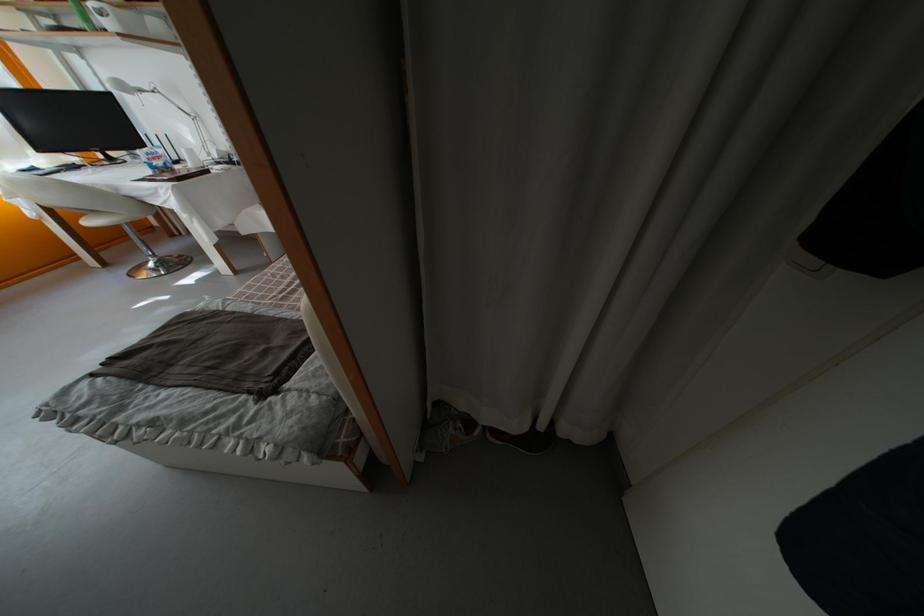
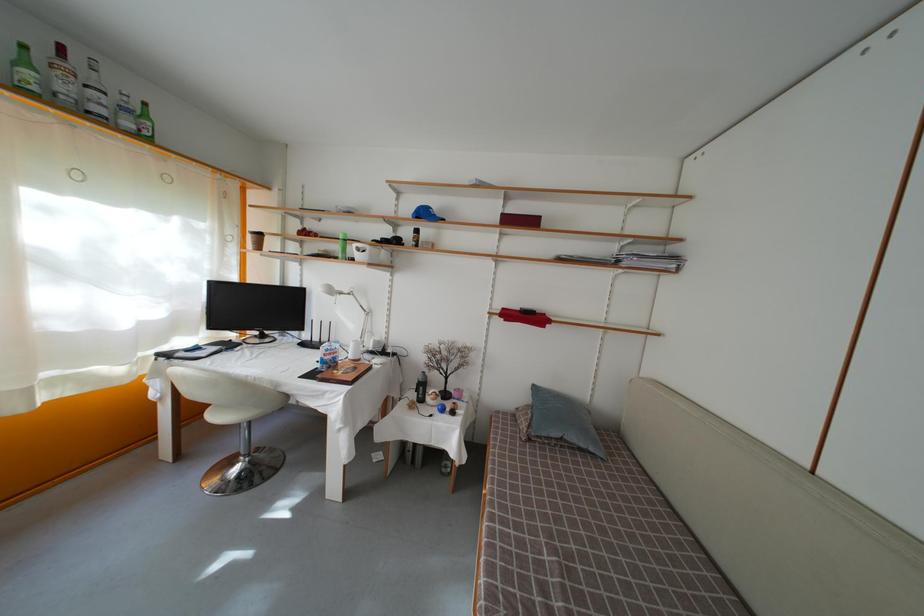
Locate, in the second image, the point that corresponds to the point at 96,229 in the first image.

(221, 422)